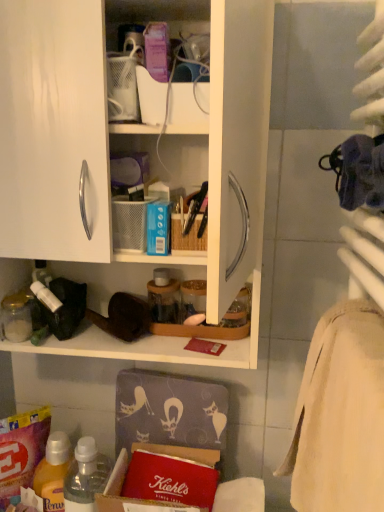
Question: Would you say beige cotton bath towel at right is to the left or to the right of matte plastic container at upper center in the picture?

Choices:
 (A) left
 (B) right

Answer: (B)

Question: In terms of width, does beige cotton bath towel at right look wider or thinner when compared to matte plastic container at upper center?

Choices:
 (A) thin
 (B) wide

Answer: (B)

Question: Which object is the farthest from the beige cotton bath towel at right?

Choices:
 (A) matte plastic container at upper center
 (B) translucent plastic bottle at lower left
 (C) white matte cabinet at upper left

Answer: (A)

Question: Which object is the closest to the white matte cabinet at upper left?

Choices:
 (A) beige cotton bath towel at right
 (B) translucent plastic bottle at lower left
 (C) matte plastic container at upper center

Answer: (C)